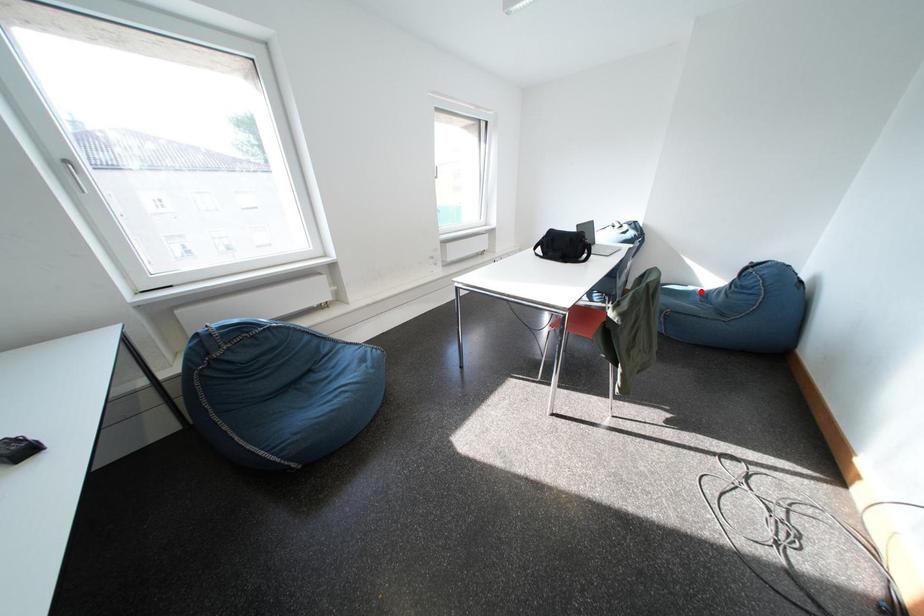
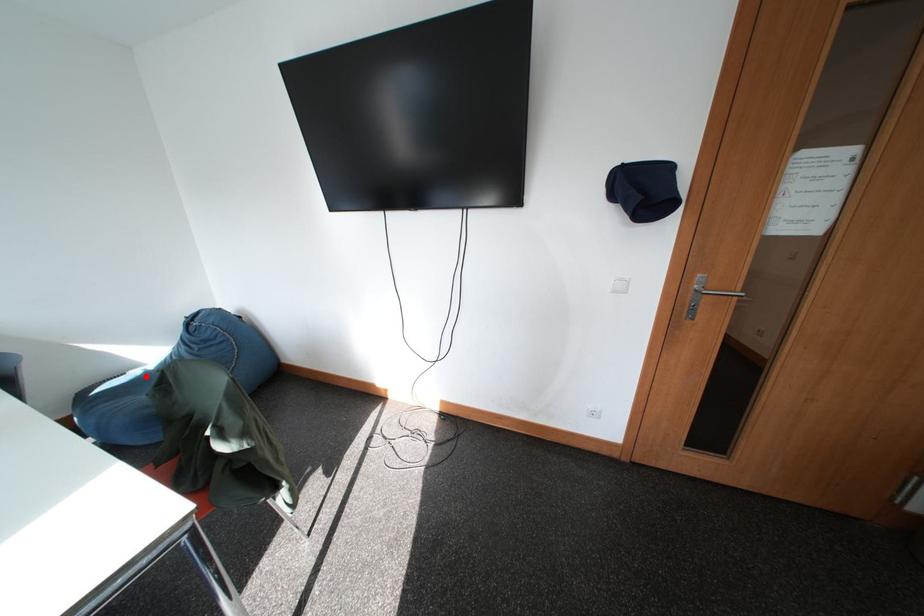
I am providing you with two images of the same scene from different viewpoints. A red point is marked on the first image and another point is marked on the second image. Are the points marked in image1 and image2 representing the same 3D position?

Yes